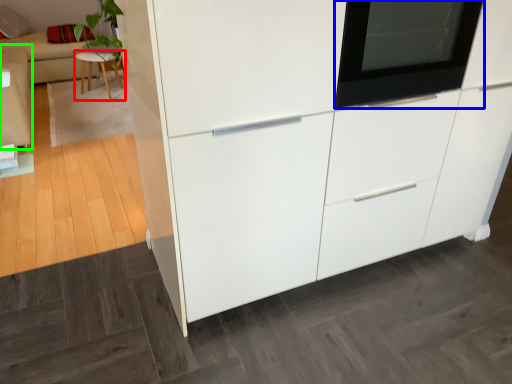
Question: Considering the real-world distances, which object is farthest from furniture (highlighted by a red box)? oven (highlighted by a blue box) or couch (highlighted by a green box)?

Choices:
 (A) oven
 (B) couch

Answer: (A)